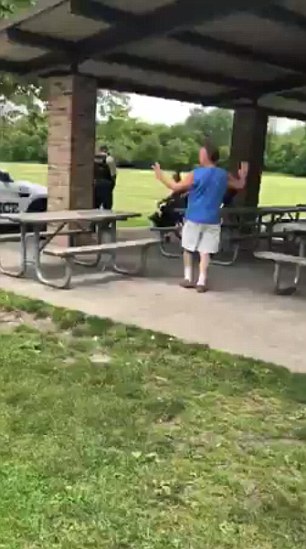
The height and width of the screenshot is (549, 306). Find the location of `bench`. bench is located at coordinates (71, 250).